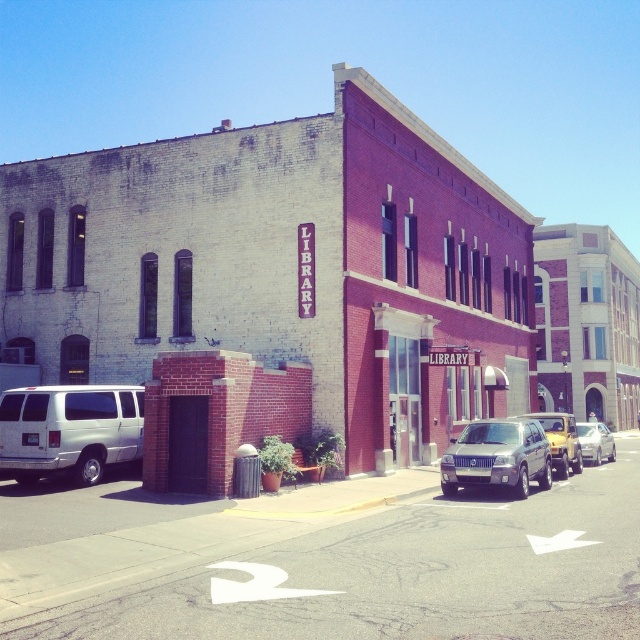
Question: Estimate the real-world distances between objects in this image. Which object is farther from the brick building at center?

Choices:
 (A) white matte van at left
 (B) silver metallic sedan at center right

Answer: (A)

Question: Which of the following is the farthest from the observer?

Choices:
 (A) (444, 460)
 (B) (572, 244)
 (C) (129, 406)

Answer: (B)

Question: Which point is farther from the camera taking this photo?

Choices:
 (A) (10, 401)
 (B) (628, 333)

Answer: (B)

Question: Can you confirm if brick building at center is positioned to the left of silver metallic sedan at center right?

Choices:
 (A) no
 (B) yes

Answer: (A)

Question: Does white matte van at left have a larger size compared to silver metallic sedan at center right?

Choices:
 (A) yes
 (B) no

Answer: (B)

Question: Is the position of satin silver suv at center less distant than that of silver metallic sedan at center right?

Choices:
 (A) yes
 (B) no

Answer: (A)